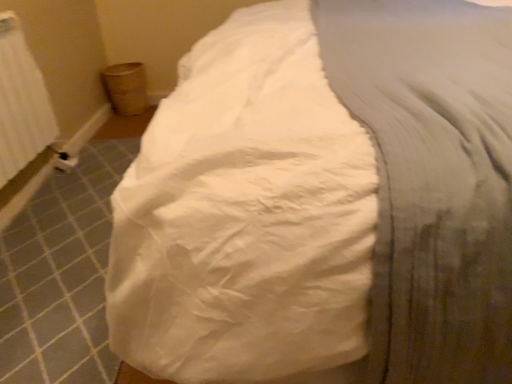
In order to face white textured radiator at left, should I rotate leftwards or rightwards?

To face it directly, rotate left by 31.305 degrees.

You are a GUI agent. You are given a task and a screenshot of the screen. Output one action in this format:
    pyautogui.click(x=<x>, y=<y>)
    Task: Click on the white textured radiator at left
    This screenshot has width=512, height=384.
    Given the screenshot: What is the action you would take?
    pyautogui.click(x=21, y=102)

Describe the element at coordinates (21, 102) in the screenshot. Image resolution: width=512 pixels, height=384 pixels. I see `white textured radiator at left` at that location.

What is the approximate height of white cotton sheet at center?

It is 25.20 inches.

What do you see at coordinates (433, 179) in the screenshot? The image size is (512, 384). I see `white cotton sheet at center` at bounding box center [433, 179].

You are a GUI agent. You are given a task and a screenshot of the screen. Output one action in this format:
    pyautogui.click(x=<x>, y=<y>)
    Task: Click on the white cotton sheet at center
    
    Given the screenshot: What is the action you would take?
    pyautogui.click(x=433, y=179)

You are a GUI agent. You are given a task and a screenshot of the screen. Output one action in this format:
    pyautogui.click(x=<x>, y=<y>)
    Task: Click on the white textured radiator at left
    The image size is (512, 384).
    Given the screenshot: What is the action you would take?
    pyautogui.click(x=21, y=102)

Can you confirm if white cotton sheet at center is positioned to the right of white textured radiator at left?

Correct, you'll find white cotton sheet at center to the right of white textured radiator at left.

Does white cotton sheet at center come behind white textured radiator at left?

No, it is in front of white textured radiator at left.

Which is closer, (385,260) or (19,76)?

The point (385,260) is closer.

In the scene shown: From the image's perspective, which is below, white cotton sheet at center or white textured radiator at left?

white cotton sheet at center, from the image's perspective.

From a real-world perspective, is white cotton sheet at center physically above white textured radiator at left?

Actually, white cotton sheet at center is physically below white textured radiator at left in the real world.

Can you confirm if white cotton sheet at center is thinner than white textured radiator at left?

Incorrect, the width of white cotton sheet at center is not less than that of white textured radiator at left.

From their relative heights in the image, would you say white cotton sheet at center is taller or shorter than white textured radiator at left?

Considering their sizes, white cotton sheet at center has more height than white textured radiator at left.

From the picture: Which of these two, white cotton sheet at center or white textured radiator at left, is bigger?

white cotton sheet at center is bigger.

Consider the image. Is white cotton sheet at center inside the boundaries of white textured radiator at left, or outside?

white cotton sheet at center lies outside white textured radiator at left.

Are white cotton sheet at center and white textured radiator at left far apart?

Yes, white cotton sheet at center and white textured radiator at left are quite far apart.

Is white cotton sheet at center looking in the opposite direction of white textured radiator at left?

No, white cotton sheet at center is not facing the opposite direction of white textured radiator at left.

The image size is (512, 384). What are the coordinates of `sheet located underneath the white textured radiator at left (from a real-world perspective)` in the screenshot? It's located at [433, 179].

Which is more to the right, white textured radiator at left or white cotton sheet at center?

white cotton sheet at center.

Which is behind, white textured radiator at left or white cotton sheet at center?

white textured radiator at left is further away from the camera.

Is point (44, 101) farther from viewer compared to point (462, 332)?

That is True.

From the image's perspective, which one is positioned higher, white textured radiator at left or white cotton sheet at center?

white textured radiator at left.

From a real-world perspective, does white textured radiator at left stand above white cotton sheet at center?

Yes, from a real-world perspective, white textured radiator at left is on top of white cotton sheet at center.

In terms of width, does white textured radiator at left look wider or thinner when compared to white cotton sheet at center?

Considering their sizes, white textured radiator at left looks slimmer than white cotton sheet at center.

Does white textured radiator at left have a greater height compared to white cotton sheet at center?

Incorrect, the height of white textured radiator at left is not larger of that of white cotton sheet at center.

Between white textured radiator at left and white cotton sheet at center, which one has larger size?

Bigger between the two is white cotton sheet at center.

Is white textured radiator at left spatially inside white cotton sheet at center, or outside of it?

The correct answer is: outside.

Would you consider white textured radiator at left to be distant from white cotton sheet at center?

Yes, white textured radiator at left and white cotton sheet at center are located far from each other.

Looking at this image, is white cotton sheet at center at the back of white textured radiator at left?

No, white textured radiator at left is not facing the opposite direction of white cotton sheet at center.

How many degrees apart are the facing directions of white textured radiator at left and white cotton sheet at center?

They differ by 178 degrees in their facing directions.

Where is `sheet below the white textured radiator at left (from a real-world perspective)`? The image size is (512, 384). sheet below the white textured radiator at left (from a real-world perspective) is located at coordinates (433, 179).

Image resolution: width=512 pixels, height=384 pixels. Find the location of `sheet in front of the white textured radiator at left`. sheet in front of the white textured radiator at left is located at coordinates (433, 179).

This screenshot has width=512, height=384. I want to click on sheet on the right of the white textured radiator at left, so click(x=433, y=179).